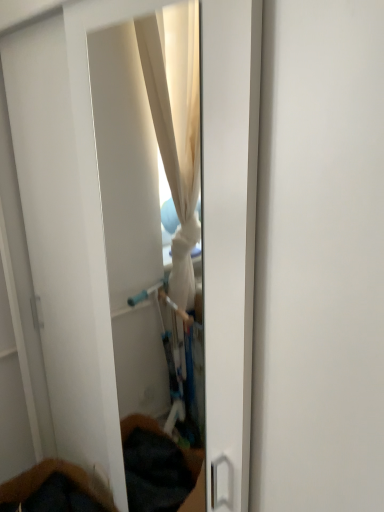
Describe the element at coordinates (143, 185) in the screenshot. I see `white glossy door at center` at that location.

Consider the image. What is the approximate width of white glossy door at center?

white glossy door at center is 0.47 inches in width.

The height and width of the screenshot is (512, 384). In order to click on white glossy door at center in this screenshot , I will do `click(143, 185)`.

Where is `white glossy door at center`? The image size is (384, 512). white glossy door at center is located at coordinates (143, 185).